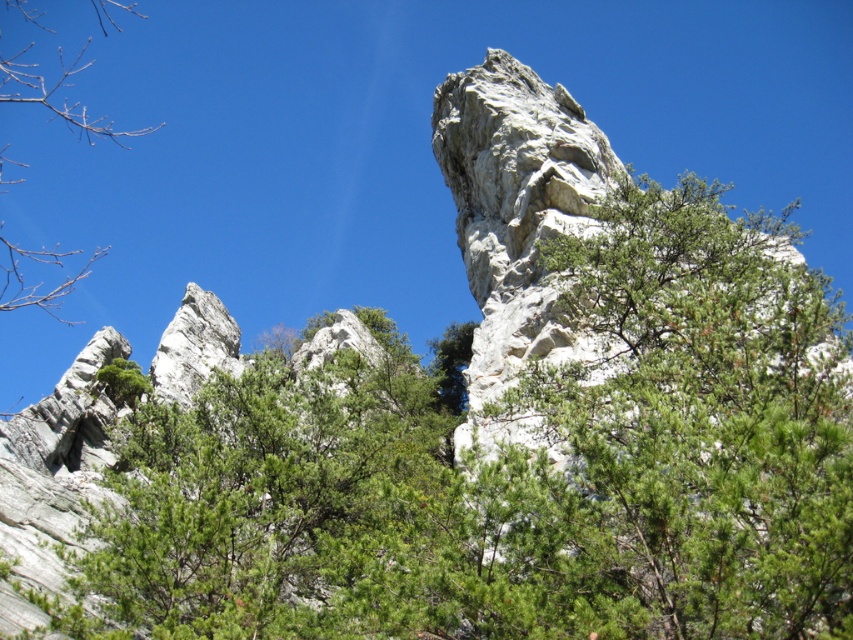
You are standing at the base of the towering rock pillar and notice a green leafy tree at upper right. Based on its position, which direction should you walk to get closer to the tree?

The green leafy tree at upper right is located at point coordinates, so you should walk towards the upper right direction to get closer to the tree.

You are a bird looking for a place to perch. You see two green leafy trees in the upper part of the landscape. The one at upper center and the one at upper right. If you can fly 9 meters, can you fly from the green leafy tree at upper center to the green leafy tree at upper right?

The green leafy tree at upper center and the green leafy tree at upper right are 8.79 meters apart. Since the distance is less than 9 meters, the bird can fly from the green leafy tree at upper center to the green leafy tree at upper right.

You are standing at the base of the towering rock pillar in the center of the image. Looking up, you notice a point marked at coordinates (511, 467). What object is located at this point?

The point at coordinates (511, 467) marks a green leafy tree at upper center.